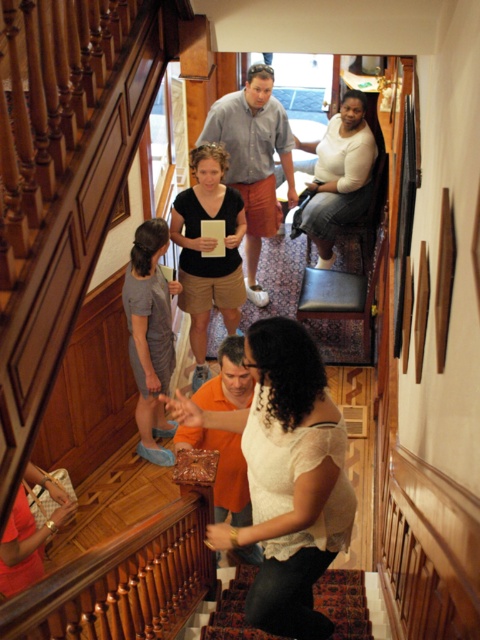
Is point (336, 538) closer to camera compared to point (199, 628)?

Yes, point (336, 538) is closer to viewer.

Is point (283, 323) more distant than point (382, 604)?

No, it is not.

In order to click on white lace blouse at center in this screenshot , I will do `click(286, 476)`.

Does white cotton shirt at center have a smaller size compared to carpeted stairs at center?

Incorrect, white cotton shirt at center is not smaller in size than carpeted stairs at center.

Who is more forward, (348, 220) or (384, 637)?

Positioned in front is point (384, 637).

Locate an element on the screen. The width and height of the screenshot is (480, 640). white cotton shirt at center is located at coordinates (338, 176).

Locate an element on the screen. The width and height of the screenshot is (480, 640). white cotton shirt at center is located at coordinates (338, 176).

Can you confirm if white lace blouse at center is positioned to the right of white cotton shirt at center?

No, white lace blouse at center is not to the right of white cotton shirt at center.

Who is more distant from viewer, (285, 461) or (343, 106)?

Point (343, 106)

In order to click on white lace blouse at center in this screenshot , I will do `click(286, 476)`.